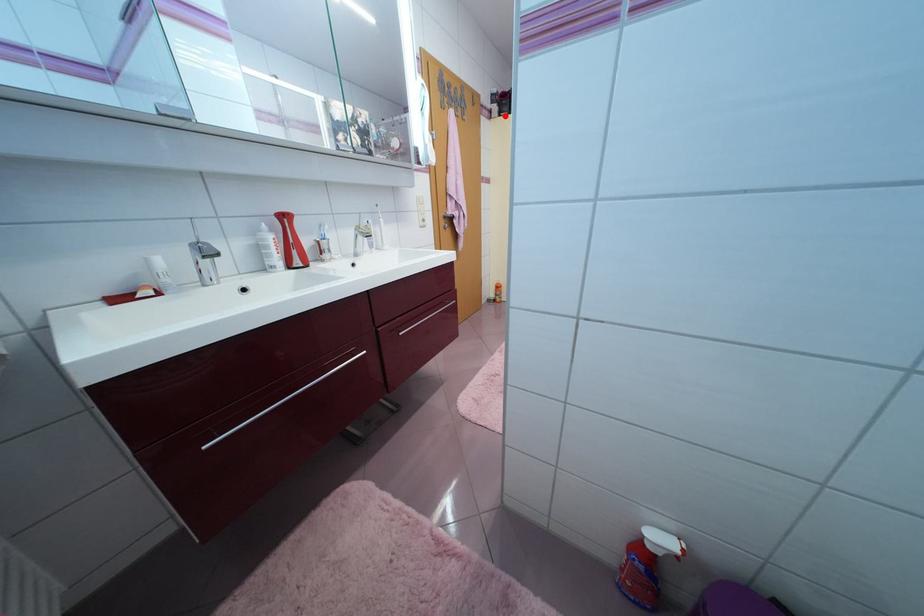
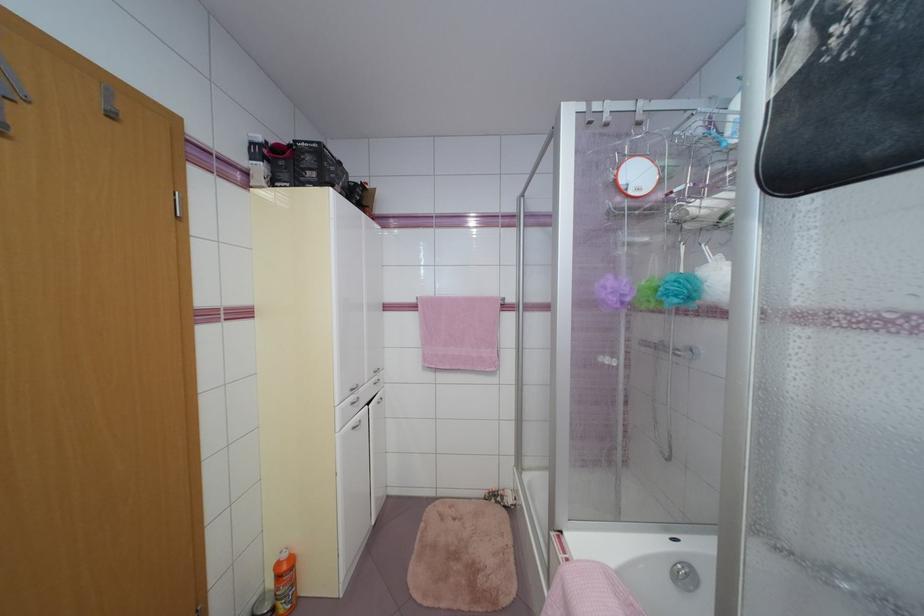
Where in the second image is the point corresponding to the highlighted location from the first image?

(276, 185)